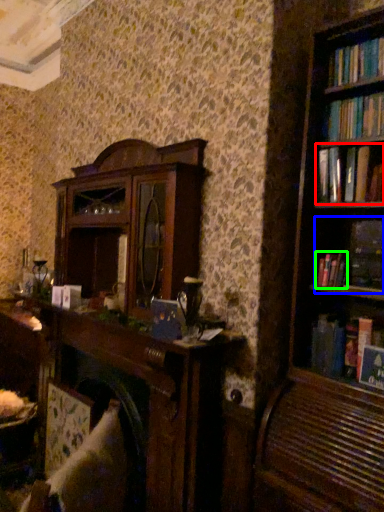
Question: Based on their relative distances, which object is farther from book (highlighted by a red box)? Choose from book (highlighted by a blue box) and book (highlighted by a green box).

Choices:
 (A) book
 (B) book

Answer: (B)